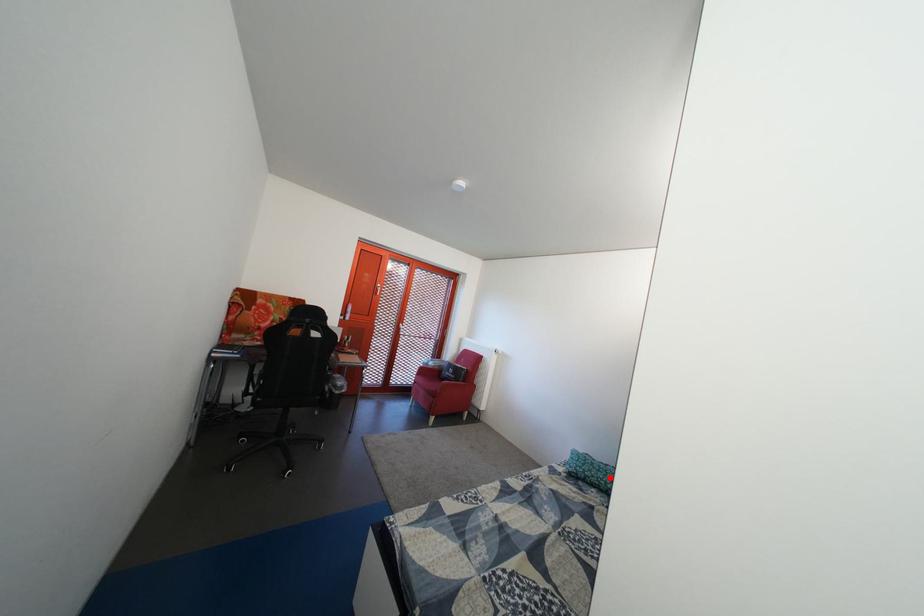
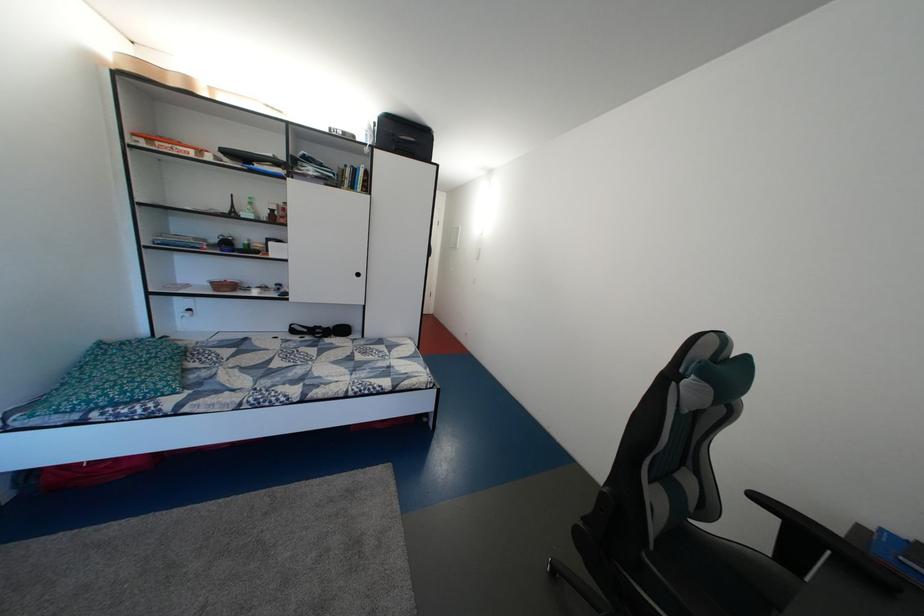
The point at the highlighted location is marked in the first image. Where is the corresponding point in the second image?

(160, 376)